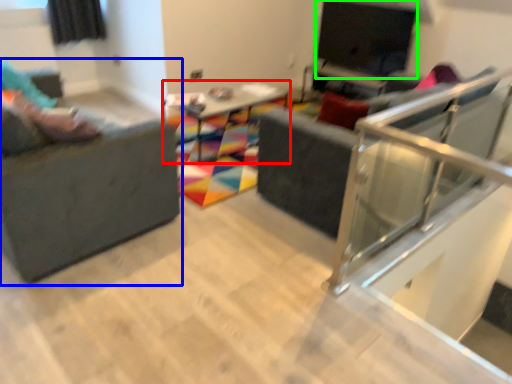
Question: Based on their relative distances, which object is farther from table (highlighted by a red box)? Choose from studio couch (highlighted by a blue box) and window screen (highlighted by a green box).

Choices:
 (A) studio couch
 (B) window screen

Answer: (A)